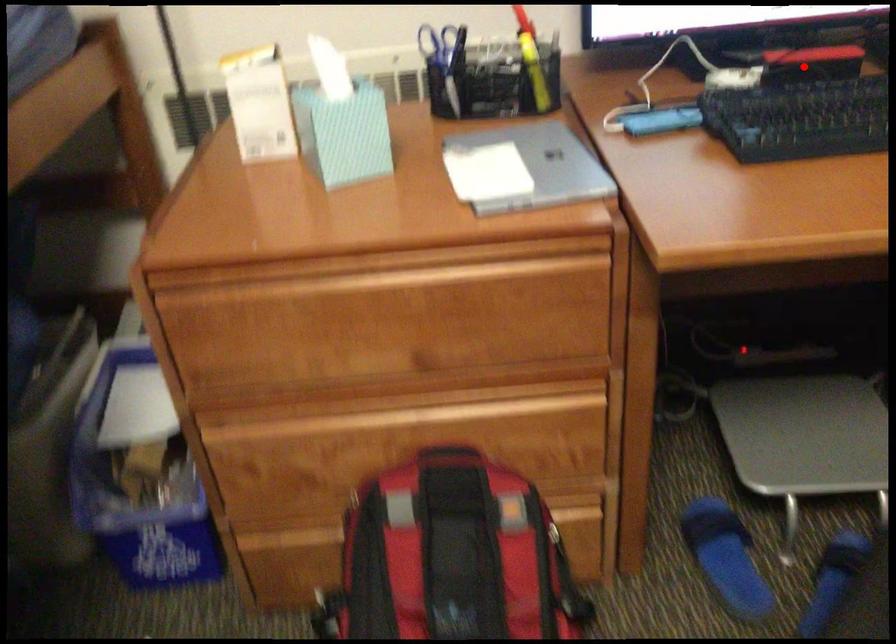
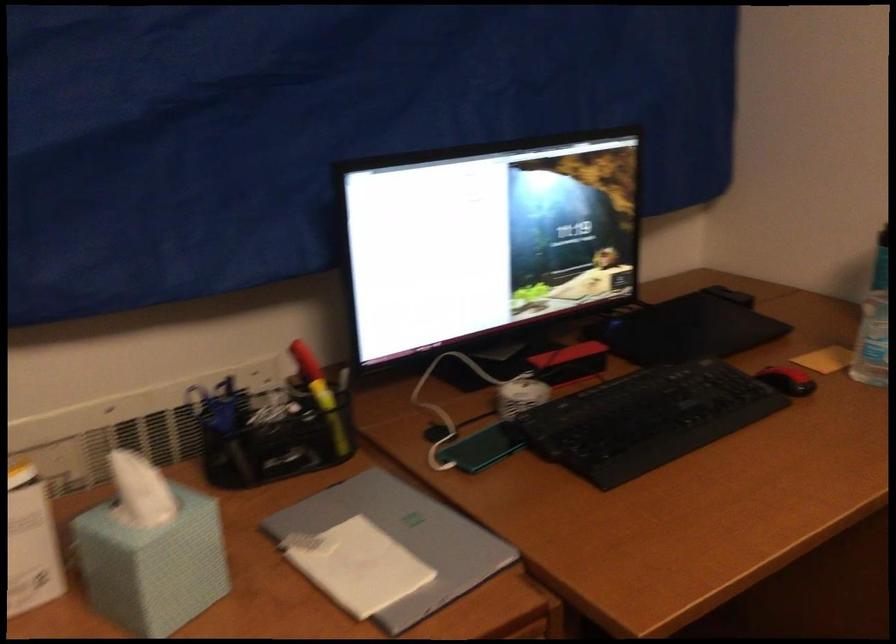
Find the pixel in the second image that matches the highlighted location in the first image.

(570, 363)